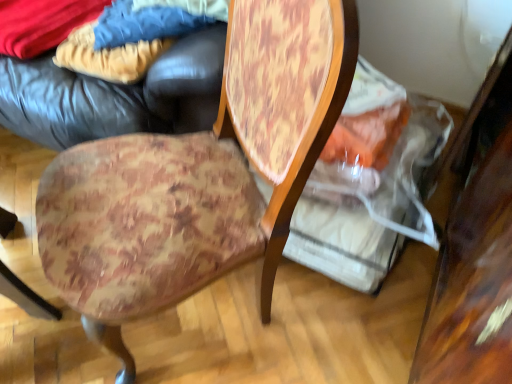
This screenshot has width=512, height=384. What do you see at coordinates (154, 20) in the screenshot?
I see `blue denim jeans at upper left, the first fabric positioned from the right` at bounding box center [154, 20].

I want to click on wooden table at right, so click(475, 247).

Does point (45, 50) come in front of point (127, 147)?

No, (45, 50) is further to viewer.

Could you tell me if velvety blue blanket at upper left, which appears as the third fabric when viewed from the right, is facing floral fabric cushion at center?

No, velvety blue blanket at upper left, which appears as the third fabric when viewed from the right, does not turn towards floral fabric cushion at center.

Is the surface of velvety blue blanket at upper left, the first fabric from the left, in direct contact with floral fabric cushion at center?

No, velvety blue blanket at upper left, the first fabric from the left, is not with floral fabric cushion at center.

Consider the image. Could floral fabric cushion at center be considered to be inside velvety blue blanket at upper left, which appears as the third fabric when viewed from the right?

No, velvety blue blanket at upper left, which appears as the third fabric when viewed from the right, does not contain floral fabric cushion at center.

Is velvet-like beige pants at upper left, the second fabric viewed from the left, turned away from floral fabric cushion at center?

velvet-like beige pants at upper left, the second fabric viewed from the left, does not have its back to floral fabric cushion at center.

How many degrees apart are the facing directions of velvet-like beige pants at upper left, the second fabric viewed from the left, and floral fabric cushion at center?

The angle between the facing direction of velvet-like beige pants at upper left, the second fabric viewed from the left, and the facing direction of floral fabric cushion at center is 59.5 degrees.

Visually, is velvet-like beige pants at upper left, the 2th fabric when ordered from right to left, positioned to the left or to the right of floral fabric cushion at center?

From the image, it's evident that velvet-like beige pants at upper left, the 2th fabric when ordered from right to left, is to the left of floral fabric cushion at center.

Considering the relative sizes of velvet-like beige pants at upper left, the 2th fabric when ordered from right to left, and floral fabric cushion at center in the image provided, is velvet-like beige pants at upper left, the 2th fabric when ordered from right to left, taller than floral fabric cushion at center?

In fact, velvet-like beige pants at upper left, the 2th fabric when ordered from right to left, may be shorter than floral fabric cushion at center.

From a real-world perspective, is velvety blue blanket at upper left, which appears as the third fabric when viewed from the right, above or below wooden table at right?

In terms of real-world spatial position, velvety blue blanket at upper left, which appears as the third fabric when viewed from the right, is above wooden table at right.

Is the depth of velvety blue blanket at upper left, the first fabric from the left, less than that of wooden table at right?

That is False.

Image resolution: width=512 pixels, height=384 pixels. What are the coordinates of `table lying below the velvety blue blanket at upper left, the first fabric from the left (from the image's perspective)` in the screenshot? It's located at (475, 247).

Looking at the image, does velvety blue blanket at upper left, which appears as the third fabric when viewed from the right, seem bigger or smaller compared to wooden table at right?

Clearly, velvety blue blanket at upper left, which appears as the third fabric when viewed from the right, is smaller in size than wooden table at right.

Is blue denim jeans at upper left, the first fabric positioned from the right, not inside floral fabric cushion at center?

blue denim jeans at upper left, the first fabric positioned from the right, is positioned outside floral fabric cushion at center.

From a real-world perspective, relative to floral fabric cushion at center, is blue denim jeans at upper left, the 3th fabric positioned from the left, vertically above or below?

In terms of real-world spatial position, blue denim jeans at upper left, the 3th fabric positioned from the left, is above floral fabric cushion at center.

Is point (163, 1) farther from camera compared to point (263, 306)?

Yes, point (163, 1) is behind point (263, 306).

From the image's perspective, which fabric is the 1st one above the floral fabric cushion at center? Please provide its 2D coordinates.

[(154, 20)]

Is leather bean bag at upper left oriented away from velvet-like beige pants at upper left, the 2th fabric when ordered from right to left?

Yes, velvet-like beige pants at upper left, the 2th fabric when ordered from right to left, is at the back of leather bean bag at upper left.

What's the angular difference between leather bean bag at upper left and velvet-like beige pants at upper left, the 2th fabric when ordered from right to left,'s facing directions?

There is a 22.7-degree angle between the facing directions of leather bean bag at upper left and velvet-like beige pants at upper left, the 2th fabric when ordered from right to left.

Is point (116, 99) positioned before point (97, 26)?

Yes, point (116, 99) is in front of point (97, 26).

I want to click on the 1st fabric below the velvety blue blanket at upper left, the first fabric from the left (from the image's perspective), so click(x=132, y=40).

Does velvety blue blanket at upper left, the first fabric from the left, come in front of velvet-like beige pants at upper left, the 2th fabric when ordered from right to left?

No, it is not.

Considering the sizes of objects velvety blue blanket at upper left, the first fabric from the left, and velvet-like beige pants at upper left, the second fabric viewed from the left, in the image provided, who is thinner, velvety blue blanket at upper left, the first fabric from the left, or velvet-like beige pants at upper left, the second fabric viewed from the left,?

velvet-like beige pants at upper left, the second fabric viewed from the left, is thinner.

Is velvety blue blanket at upper left, the first fabric from the left, spatially inside velvet-like beige pants at upper left, the 2th fabric when ordered from right to left, or outside of it?

velvety blue blanket at upper left, the first fabric from the left, is located beyond the bounds of velvet-like beige pants at upper left, the 2th fabric when ordered from right to left.

From the image's perspective, is blue denim jeans at upper left, the first fabric positioned from the right, positioned above or below velvety blue blanket at upper left, which appears as the third fabric when viewed from the right?

From the image's perspective, blue denim jeans at upper left, the first fabric positioned from the right, appears below velvety blue blanket at upper left, which appears as the third fabric when viewed from the right.

Between blue denim jeans at upper left, the first fabric positioned from the right, and velvety blue blanket at upper left, the first fabric from the left, which one is positioned behind?

velvety blue blanket at upper left, the first fabric from the left, is further away from the camera.

Considering the positions of points (177, 3) and (90, 20), is point (177, 3) closer to camera compared to point (90, 20)?

Yes.

Considering the sizes of objects blue denim jeans at upper left, the 3th fabric positioned from the left, and velvety blue blanket at upper left, which appears as the third fabric when viewed from the right, in the image provided, who is thinner, blue denim jeans at upper left, the 3th fabric positioned from the left, or velvety blue blanket at upper left, which appears as the third fabric when viewed from the right,?

Thinner between the two is blue denim jeans at upper left, the 3th fabric positioned from the left.

Identify the location of chair that is on the right side of velvety blue blanket at upper left, the first fabric from the left. (207, 201).

Where is `the 2nd fabric behind the floral fabric cushion at center, counting from the anchor's position`? the 2nd fabric behind the floral fabric cushion at center, counting from the anchor's position is located at coordinates pyautogui.click(x=132, y=40).

Considering their positions, is floral fabric cushion at center positioned closer to velvet-like beige pants at upper left, the second fabric viewed from the left, than velvety blue blanket at upper left, the first fabric from the left?

The object closer to velvet-like beige pants at upper left, the second fabric viewed from the left, is velvety blue blanket at upper left, the first fabric from the left.

Based on their spatial positions, is leather bean bag at upper left or floral fabric cushion at center further from wooden table at right?

The object further to wooden table at right is leather bean bag at upper left.

Considering their positions, is wooden table at right positioned further to velvet-like beige pants at upper left, the 2th fabric when ordered from right to left, than blue denim jeans at upper left, the first fabric positioned from the right?

The object further to velvet-like beige pants at upper left, the 2th fabric when ordered from right to left, is wooden table at right.

Estimate the real-world distances between objects in this image. Which object is further from velvety blue blanket at upper left, the first fabric from the left, leather bean bag at upper left or velvet-like beige pants at upper left, the second fabric viewed from the left?

Based on the image, leather bean bag at upper left appears to be further to velvety blue blanket at upper left, the first fabric from the left.

Which object lies nearer to the anchor point leather bean bag at upper left, velvet-like beige pants at upper left, the 2th fabric when ordered from right to left, or wooden table at right?

Based on the image, velvet-like beige pants at upper left, the 2th fabric when ordered from right to left, appears to be nearer to leather bean bag at upper left.

Looking at this image, looking at the image, which one is located further to blue denim jeans at upper left, the first fabric positioned from the right, wooden table at right or velvet-like beige pants at upper left, the second fabric viewed from the left?

wooden table at right is positioned further to the anchor blue denim jeans at upper left, the first fabric positioned from the right.

When comparing their distances from blue denim jeans at upper left, the 3th fabric positioned from the left, does floral fabric cushion at center or velvet-like beige pants at upper left, the 2th fabric when ordered from right to left, seem closer?

velvet-like beige pants at upper left, the 2th fabric when ordered from right to left, is closer to blue denim jeans at upper left, the 3th fabric positioned from the left.

Looking at the image, which one is located closer to blue denim jeans at upper left, the 3th fabric positioned from the left, velvety blue blanket at upper left, the first fabric from the left, or wooden table at right?

The object closer to blue denim jeans at upper left, the 3th fabric positioned from the left, is velvety blue blanket at upper left, the first fabric from the left.

Find the location of `chair between velvety blue blanket at upper left, which appears as the third fabric when viewed from the right, and wooden table at right, in the horizontal direction`. chair between velvety blue blanket at upper left, which appears as the third fabric when viewed from the right, and wooden table at right, in the horizontal direction is located at coordinates [x=207, y=201].

Where is `bean bag chair situated between velvety blue blanket at upper left, which appears as the third fabric when viewed from the right, and wooden table at right from left to right`? The height and width of the screenshot is (384, 512). bean bag chair situated between velvety blue blanket at upper left, which appears as the third fabric when viewed from the right, and wooden table at right from left to right is located at coordinates (114, 95).

The height and width of the screenshot is (384, 512). I want to click on fabric between velvety blue blanket at upper left, which appears as the third fabric when viewed from the right, and blue denim jeans at upper left, the 3th fabric positioned from the left, in the horizontal direction, so click(132, 40).

Image resolution: width=512 pixels, height=384 pixels. In order to click on fabric between floral fabric cushion at center and wooden table at right from left to right in this screenshot , I will do pyautogui.click(x=154, y=20).